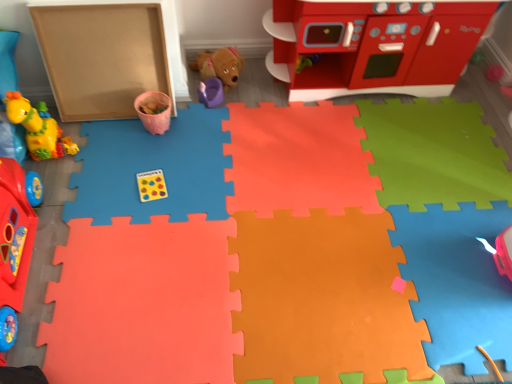
Find the location of a particular element. vacant region to the right of purple plastic cup at center, the 4th toy in the right-to-left sequence is located at coordinates (247, 105).